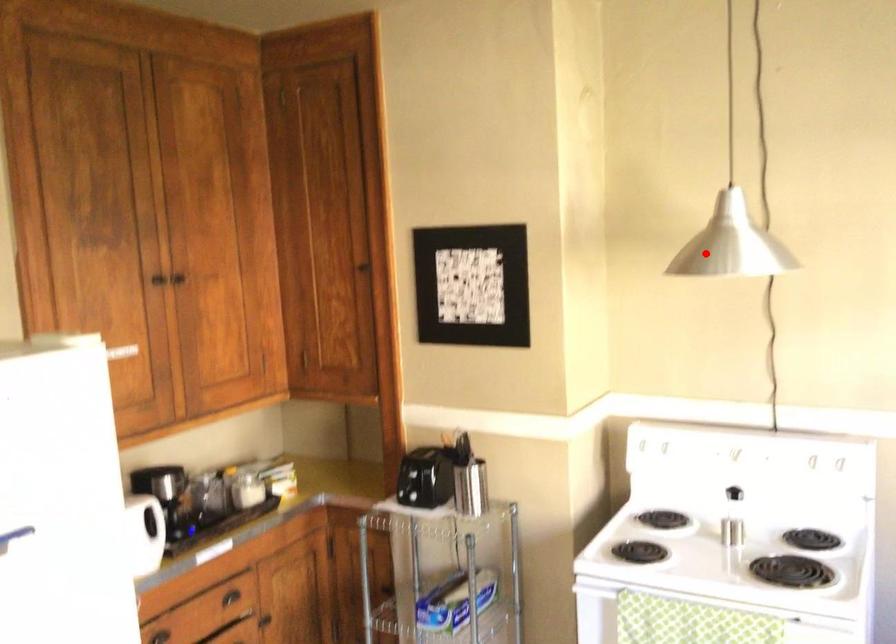
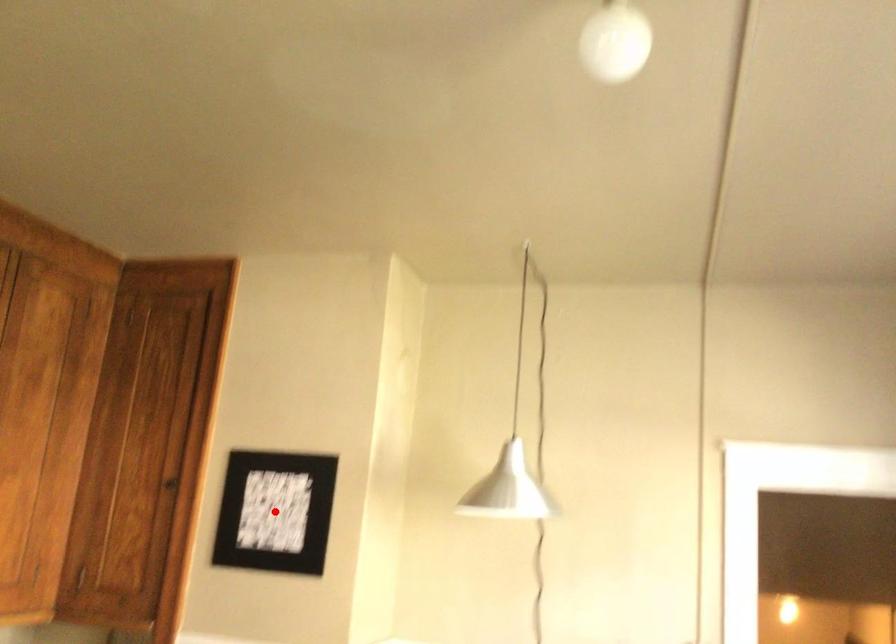
I am providing you with two images of the same scene from different viewpoints. A red point is marked on the first image and another point is marked on the second image. Do the highlighted points in image1 and image2 indicate the same real-world spot?

No